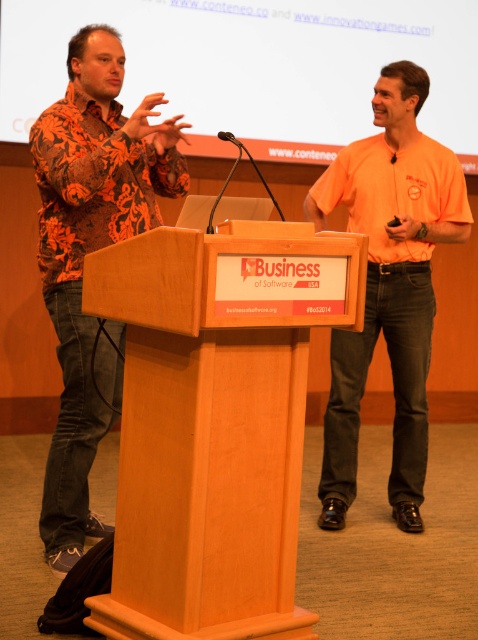
Question: Estimate the real-world distances between objects in this image. Which object is farther from the floral-patterned shirt at left?

Choices:
 (A) wooden podium at center
 (B) matte white screen at upper center

Answer: (B)

Question: Which object is positioned farthest from the orange cotton shirt at center?

Choices:
 (A) floral-patterned shirt at left
 (B) matte white screen at upper center

Answer: (B)

Question: Does matte white screen at upper center have a smaller size compared to orange cotton shirt at center?

Choices:
 (A) no
 (B) yes

Answer: (A)

Question: Which object appears farthest from the camera in this image?

Choices:
 (A) matte white screen at upper center
 (B) wooden podium at center
 (C) orange cotton shirt at center

Answer: (A)

Question: Can you confirm if wooden podium at center is positioned to the right of floral-patterned shirt at left?

Choices:
 (A) no
 (B) yes

Answer: (B)

Question: Does floral-patterned shirt at left appear over orange cotton shirt at center?

Choices:
 (A) yes
 (B) no

Answer: (B)